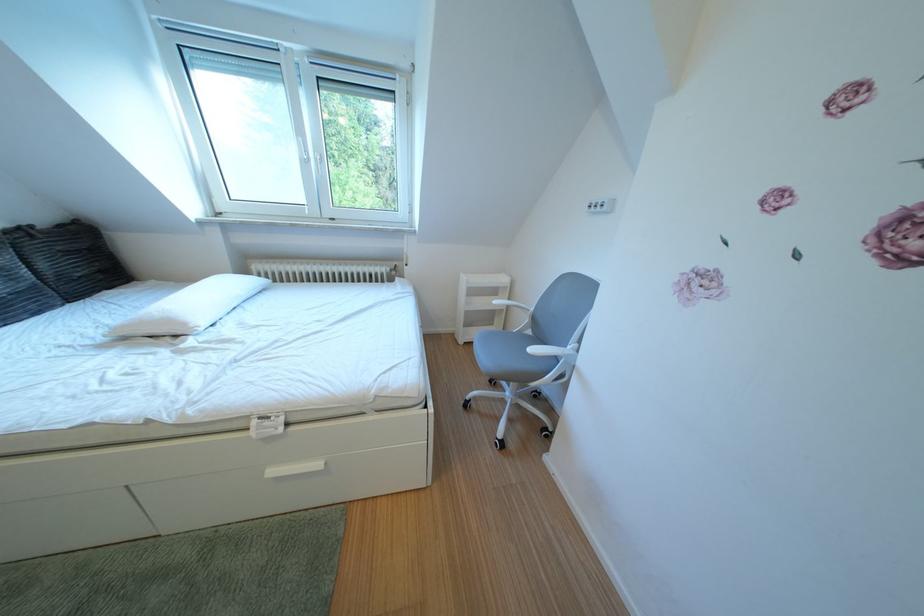
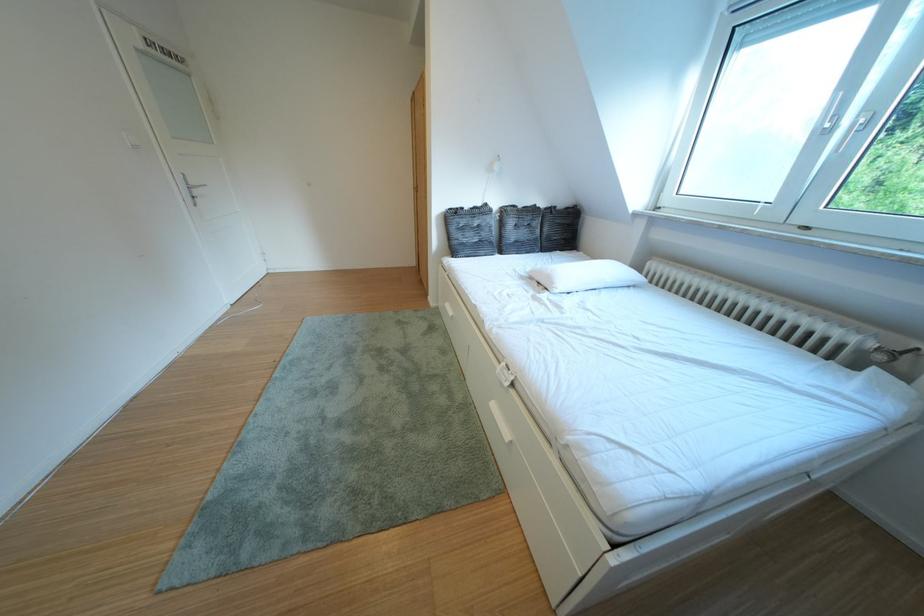
Find the pixel in the second image that matches the point at 407,278 in the first image.

(893, 363)